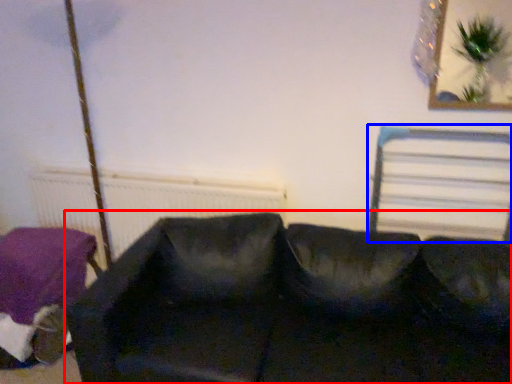
Question: Among these objects, which one is farthest to the camera, studio couch (highlighted by a red box) or bed frame (highlighted by a blue box)?

Choices:
 (A) studio couch
 (B) bed frame

Answer: (B)